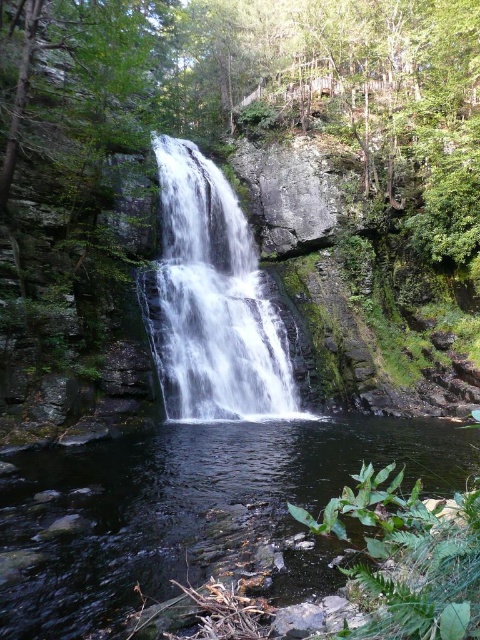
Who is shorter, clear water at center or white smooth waterfall at center?

With less height is clear water at center.

Which is behind, point (250, 544) or point (216, 356)?

The point (216, 356) is behind.

Between point (348, 458) and point (207, 168), which one is positioned in front?

Point (348, 458)

Locate an element on the screen. The height and width of the screenshot is (640, 480). clear water at center is located at coordinates (184, 508).